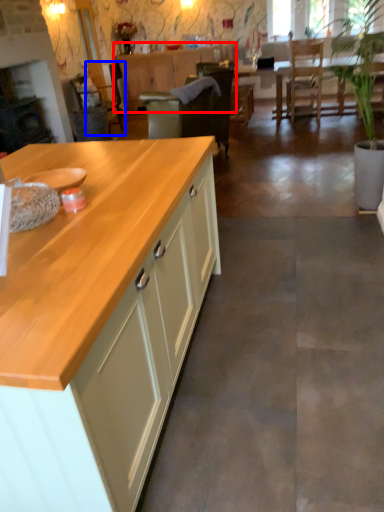
Question: Which object is further to the camera taking this photo, cabinetry (highlighted by a red box) or armchair (highlighted by a blue box)?

Choices:
 (A) cabinetry
 (B) armchair

Answer: (A)